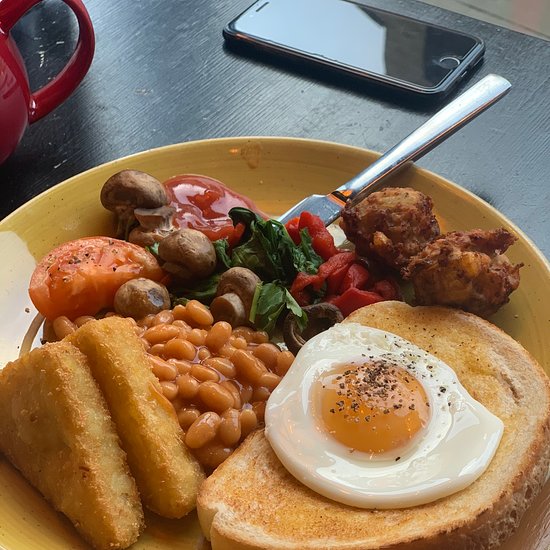
The image size is (550, 550). I want to click on plate, so click(x=277, y=170).